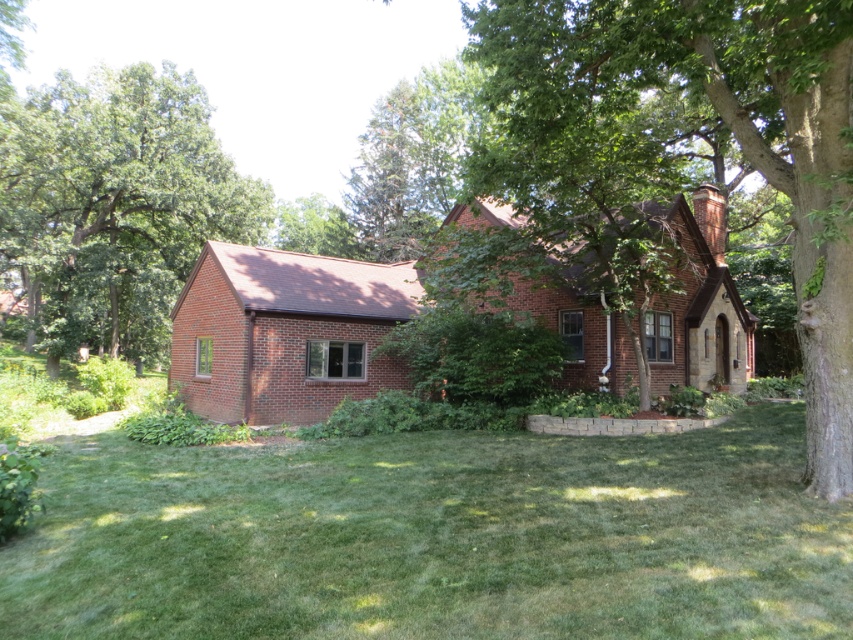
Does green leafy tree at center come in front of green leafy tree at left?

Yes, green leafy tree at center is in front of green leafy tree at left.

Is green leafy tree at center behind green leafy tree at left?

No, green leafy tree at center is in front of green leafy tree at left.

Is point (653, 65) farther from viewer compared to point (44, 166)?

That is False.

Identify the location of green leafy tree at center. (734, 136).

Does point (515, 534) come farther from viewer compared to point (190, 259)?

No, it is not.

Is green grass at lower center closer to camera compared to green leafy tree at left?

Yes, green grass at lower center is in front of green leafy tree at left.

Is point (751, 600) farther from camera compared to point (155, 116)?

No, (751, 600) is in front of (155, 116).

Find the location of a particular element. The width and height of the screenshot is (853, 640). green grass at lower center is located at coordinates (436, 538).

From the picture: Does green grass at lower center have a greater height compared to green leafy tree at center?

Incorrect, green grass at lower center's height is not larger of green leafy tree at center's.

Measure the distance between point (x=486, y=524) and camera.

Point (x=486, y=524) and camera are 6.32 meters apart from each other.

The width and height of the screenshot is (853, 640). What are the coordinates of `green grass at lower center` in the screenshot? It's located at (436, 538).